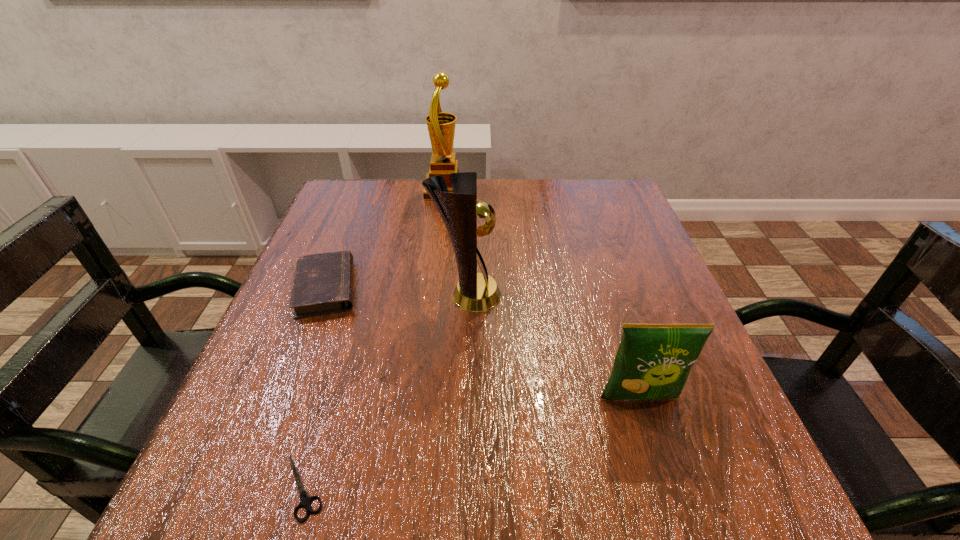
This screenshot has height=540, width=960. Identify the location of vacant space located 0.110m on the back of the second shortest object. (348, 232).

Locate an element on the screen. free space located on the left of the shortest object is located at coordinates (200, 488).

Where is `object at the far edge`? The width and height of the screenshot is (960, 540). object at the far edge is located at coordinates (441, 126).

Locate an element on the screen. object present at the near edge is located at coordinates (305, 500).

I want to click on diary that is at the left edge, so click(x=323, y=283).

Where is `shears situated at the left edge`? This screenshot has height=540, width=960. shears situated at the left edge is located at coordinates (305, 500).

This screenshot has height=540, width=960. I want to click on object that is at the right edge, so click(653, 361).

This screenshot has height=540, width=960. Identify the location of object located in the near left corner section of the desktop. pyautogui.click(x=305, y=500).

Where is `free space at the far edge of the desktop`? The image size is (960, 540). free space at the far edge of the desktop is located at coordinates tap(396, 211).

Locate an element on the screen. vacant space at the near edge of the desktop is located at coordinates (376, 477).